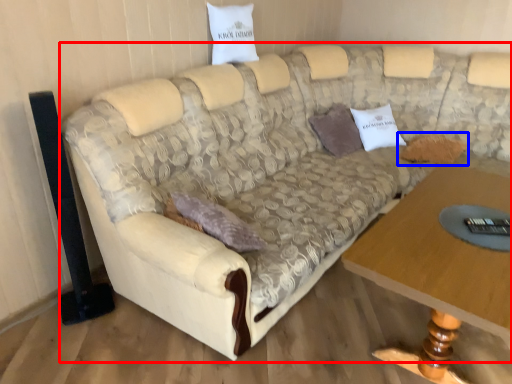
Question: Which object appears closest to the camera in this image, studio couch (highlighted by a red box) or pillow (highlighted by a blue box)?

Choices:
 (A) studio couch
 (B) pillow

Answer: (A)